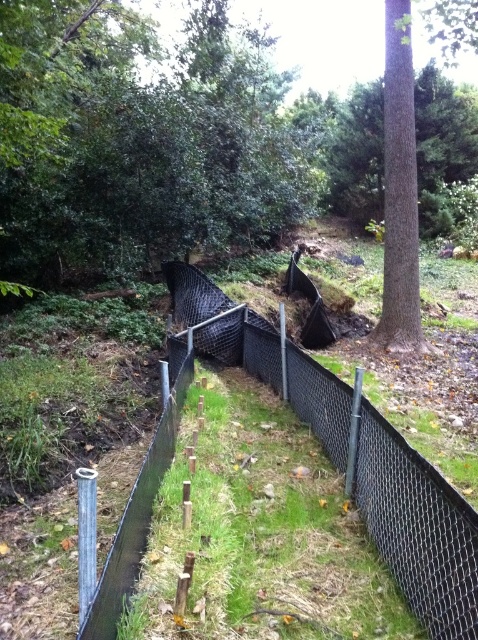
You are a surveyor tasked with marking the location of the brown textured tree at center for a new fence installation. According to the coordinates provided, where exactly should you place the marker?

The brown textured tree at center should be marked at coordinates point (142, 141).

You are a landscape architect designing a new pathway. You need to determine if the brown textured tree at center and the brown textured tree at upper right will fit within the existing fence without any branches extending beyond the fence. Based on their widths, can both trees be safely placed between the fences on either side of the path?

The brown textured tree at center might be wider than brown textured tree at upper right. Since the fence is narrow and the path is bordered by fences on both sides, the wider tree at center may not fit within the available space between the fences, while the narrower tree at upper right might fit. Therefore, only the brown textured tree at upper right can be safely placed between the fences without branches extending beyond.

You are a construction worker assigned to place a new sign on the black mesh fence at center. However, you notice a brown textured tree at upper right nearby. Based on the scene, will the tree block your access to the fence?

The black mesh fence at center is positioned under the brown textured tree at upper right, so the tree might block access to the fence depending on its branches and trunk size.